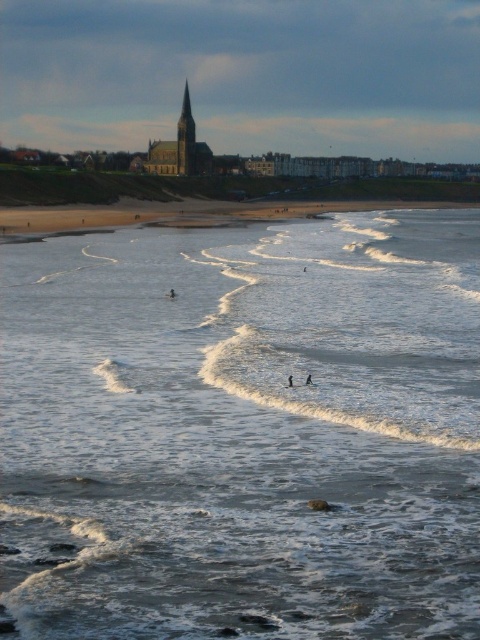
Is dark blue fabric person at center in front of black matte surfboard at lower center?

No, it is not.

Identify the location of dark blue fabric person at center. 171,292.

What do you see at coordinates (171, 292) in the screenshot? This screenshot has height=640, width=480. I see `dark blue fabric person at center` at bounding box center [171, 292].

At what (x,y) coordinates should I click in order to perform the action: click on dark blue fabric person at center. Please return your answer as a coordinate pair (x, y). The image size is (480, 640). Looking at the image, I should click on (171, 292).

Can you confirm if black matte surfboard at center is wider than black foam surfboard at center?

Incorrect, black matte surfboard at center's width does not surpass black foam surfboard at center's.

Is point (309, 376) positioned behind point (307, 384)?

Yes, it is.

Between point (311, 384) and point (308, 381), which one is positioned behind?

Positioned behind is point (308, 381).

This screenshot has height=640, width=480. What are the coordinates of `black matte surfboard at center` in the screenshot? It's located at (309, 380).

Looking at this image, can you confirm if clear water at lower center is wider than black foam surfboard at center?

Yes, clear water at lower center is wider than black foam surfboard at center.

Which of these two, clear water at lower center or black foam surfboard at center, stands taller?

Standing taller between the two is clear water at lower center.

Who is more distant from viewer, [251,520] or [310,385]?

The point [310,385] is behind.

In order to click on clear water at lower center in this screenshot , I will do `click(242, 429)`.